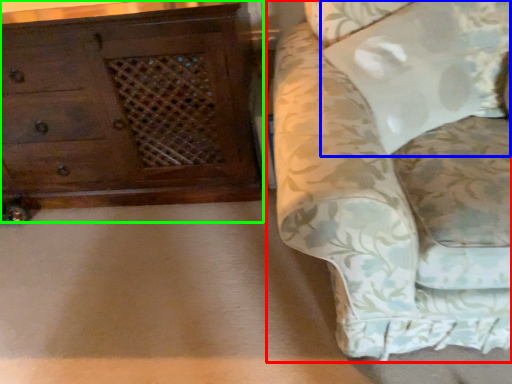
Question: Considering the real-world distances, which object is closest to studio couch (highlighted by a red box)? pillow (highlighted by a blue box) or chest of drawers (highlighted by a green box).

Choices:
 (A) pillow
 (B) chest of drawers

Answer: (A)